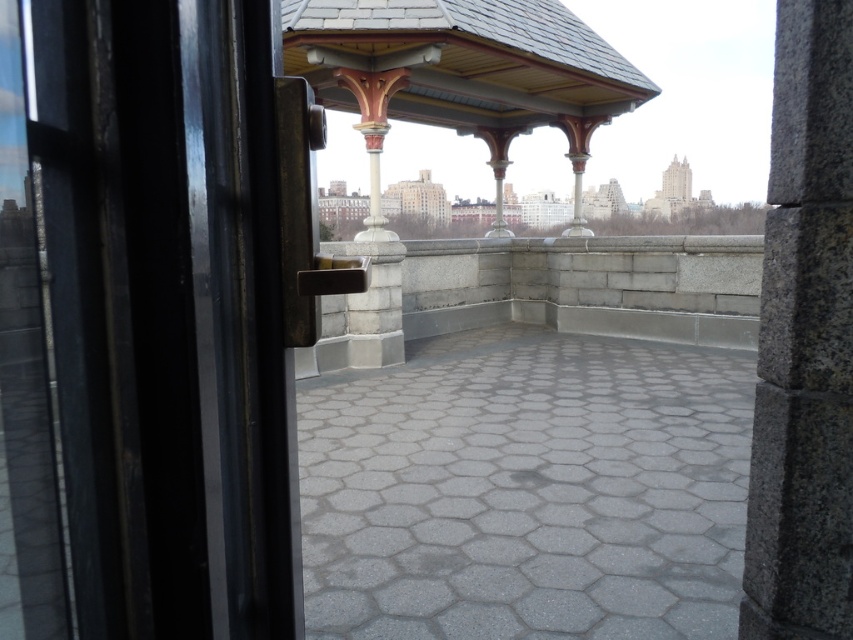
Question: Which point is closer to the camera taking this photo?

Choices:
 (A) (498, 225)
 (B) (813, 205)
 (C) (587, 234)

Answer: (B)

Question: Can you confirm if black glass door at left is smaller than wooden gazebo at center?

Choices:
 (A) no
 (B) yes

Answer: (A)

Question: Considering the real-world distances, which object is farthest from the wooden gazebo at center?

Choices:
 (A) polished stone column at center
 (B) black glass door at left
 (C) polished bronze column at center

Answer: (B)

Question: Can you confirm if polished bronze column at center is bigger than polished stone column at center?

Choices:
 (A) no
 (B) yes

Answer: (A)

Question: Can you confirm if granite pillar at right is positioned to the right of polished bronze column at center?

Choices:
 (A) no
 (B) yes

Answer: (A)

Question: Which of the following is the farthest from the observer?

Choices:
 (A) wooden gazebo at center
 (B) polished bronze column at center

Answer: (B)